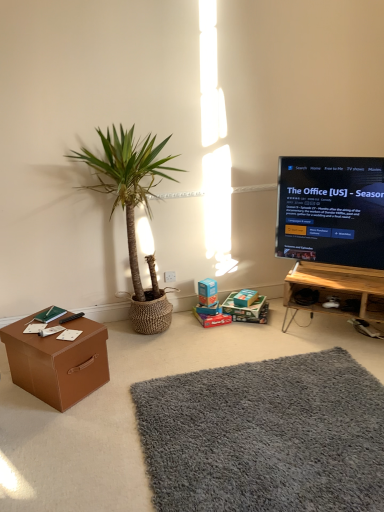
Question: Considering the positions of matte brown cardboard box at lower center and blue cardboard box at center, which is the second box from right to left, in the image, is matte brown cardboard box at lower center wider or thinner than blue cardboard box at center, which is the second box from right to left,?

Choices:
 (A) thin
 (B) wide

Answer: (B)

Question: Based on their sizes in the image, would you say matte brown cardboard box at lower center is bigger or smaller than blue cardboard box at center, which is the second box from right to left?

Choices:
 (A) small
 (B) big

Answer: (A)

Question: Based on their relative distances, which object is nearer to the blue cardboard box at center, which is the second box in back-to-front order?

Choices:
 (A) black glossy tv at right
 (B) matte brown cardboard box at lower center
 (C) wooden at lower right
 (D) cardboard box at center, the first cardboard box positioned from the left
 (E) gray shaggy rug at lower center

Answer: (D)

Question: Which object is the closest to the matte cardboard box at lower center, which ranks as the 1th box in back-to-front order?

Choices:
 (A) cardboard box at center, positioned as the 2th cardboard box in left-to-right order
 (B) matte brown cardboard box at lower center
 (C) wooden at lower right
 (D) gray shaggy rug at lower center
 (E) green woven basket at left

Answer: (A)